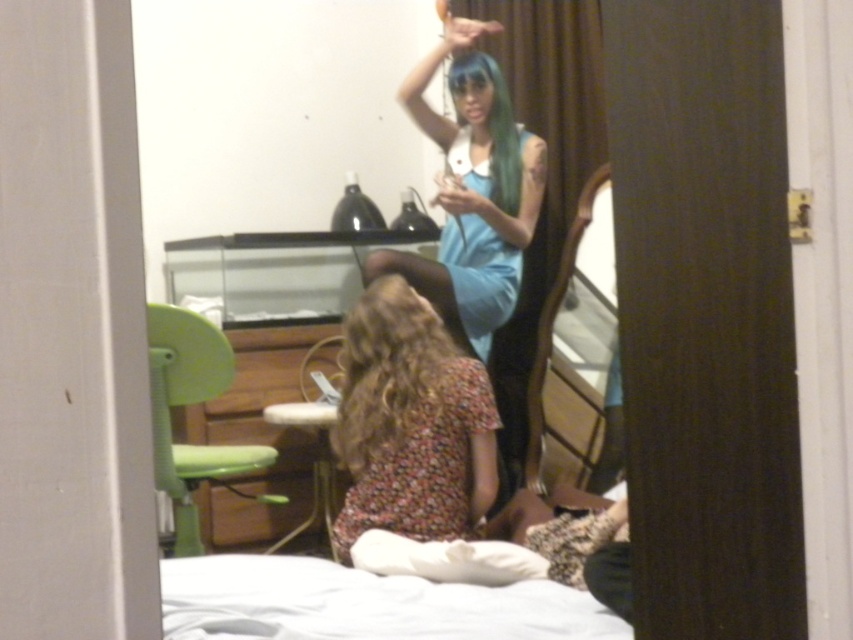
Can you confirm if curly brown hair at lower center is positioned to the left of wooden mirror at center?

Yes, curly brown hair at lower center is to the left of wooden mirror at center.

Describe the element at coordinates (386, 369) in the screenshot. The height and width of the screenshot is (640, 853). I see `curly brown hair at lower center` at that location.

Between point (352, 400) and point (579, 216), which one is positioned in front?

Point (352, 400)

Locate an element on the screen. curly brown hair at lower center is located at coordinates 386,369.

Does blue silk dress at center have a lesser height compared to curly brown hair at lower center?

In fact, blue silk dress at center may be taller than curly brown hair at lower center.

Who is shorter, blue silk dress at center or curly brown hair at lower center?

Standing shorter between the two is curly brown hair at lower center.

Find the location of a particular element. blue silk dress at center is located at coordinates (473, 189).

Is the position of floral fabric dress at center less distant than that of blue silky hair at upper center?

Yes, it is in front of blue silky hair at upper center.

Does floral fabric dress at center come behind blue silky hair at upper center?

No, floral fabric dress at center is closer to the viewer.

Is point (389, 497) closer to viewer compared to point (460, 67)?

Yes, it is.

Locate an element on the screen. floral fabric dress at center is located at coordinates (410, 424).